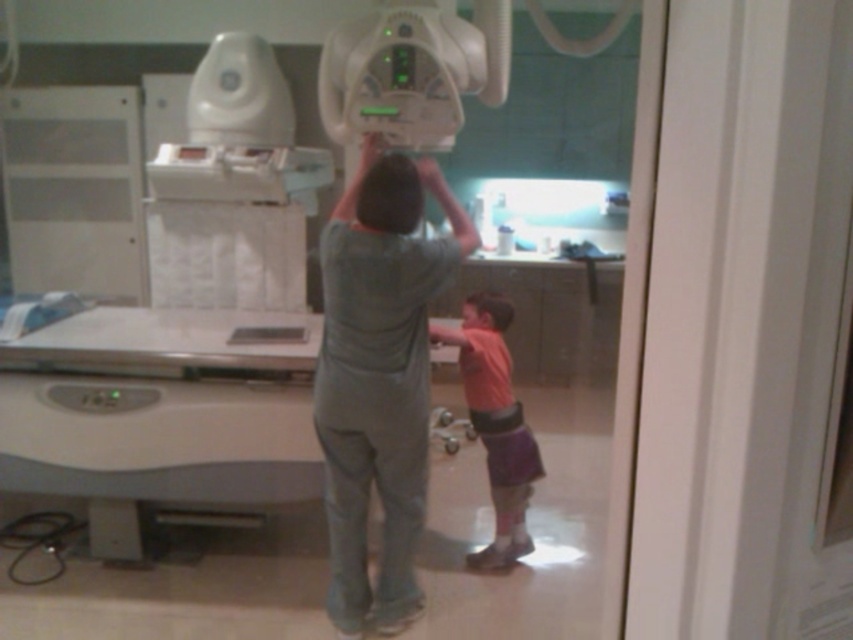
You are a medical student observing an Xray machine operation. You see the gray matte uniform at center and the matte gray head at center. Which object is positioned to the right of the other?

The gray matte uniform at center is to the right of the matte gray head at center.

Looking at this image, you are a medical technician in the room and need to reach both points to adjust some equipment. Which point, point (436,189) or point (496,292), is closer to you?

Point (436,189) is closer to the viewer than point (496,292), so you should reach for point (436,189) first.